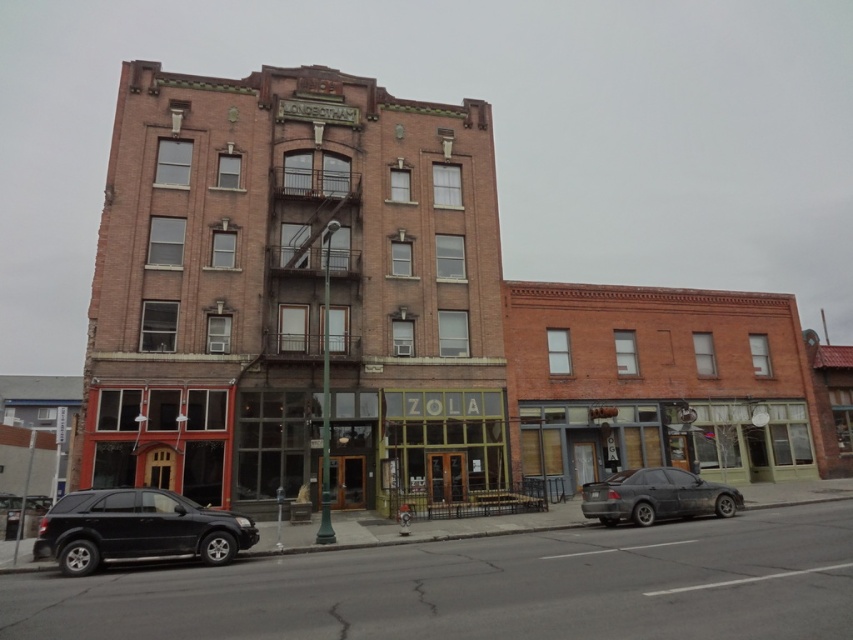
Question: Can you confirm if matte black suv at lower left is wider than dark gray matte sedan at lower right?

Choices:
 (A) no
 (B) yes

Answer: (B)

Question: Which point is farther to the camera?

Choices:
 (A) matte black suv at lower left
 (B) dark gray matte sedan at lower right

Answer: (B)

Question: Is matte black suv at lower left below dark gray matte sedan at lower right?

Choices:
 (A) no
 (B) yes

Answer: (A)

Question: Is matte black suv at lower left positioned at the back of dark gray matte sedan at lower right?

Choices:
 (A) yes
 (B) no

Answer: (B)

Question: Which of the following is the closest to the observer?

Choices:
 (A) (107, 544)
 (B) (648, 502)

Answer: (A)